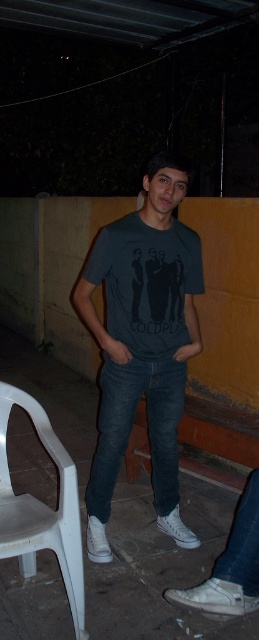
What is located at the point with coordinates (x=142, y=342) in the image?

The dark gray tshirt at center is located at point (x=142, y=342).